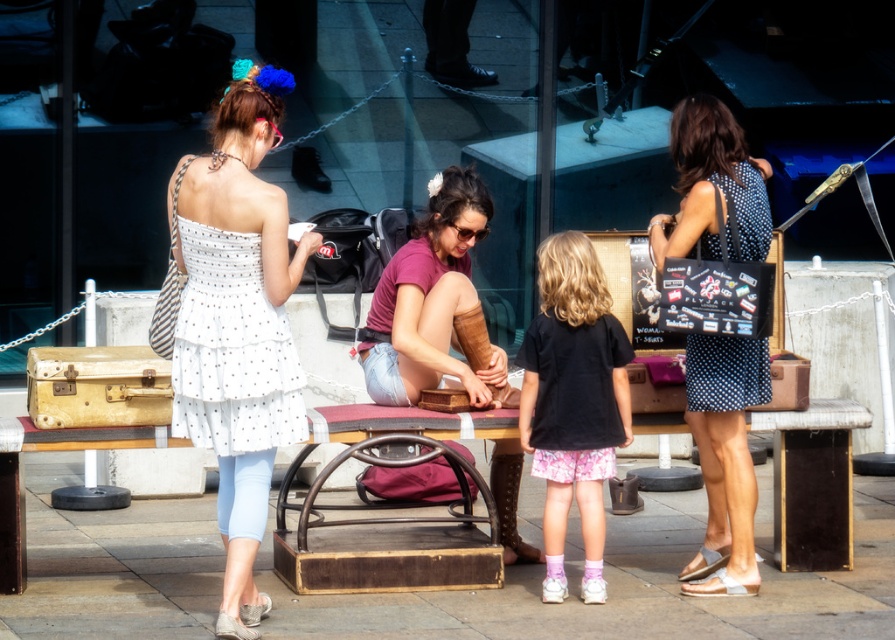
In the scene shown: Is white dotted fabric dress at left thinner than brown leather boots at center?

Correct, white dotted fabric dress at left's width is less than brown leather boots at center's.

Is white dotted fabric dress at left to the left of brown leather boots at center from the viewer's perspective?

Indeed, white dotted fabric dress at left is positioned on the left side of brown leather boots at center.

Image resolution: width=895 pixels, height=640 pixels. Find the location of `white dotted fabric dress at left`. white dotted fabric dress at left is located at coordinates (229, 342).

Does polka dot dress at right appear on the left side of black matte shirt at center?

Incorrect, polka dot dress at right is not on the left side of black matte shirt at center.

Image resolution: width=895 pixels, height=640 pixels. What are the coordinates of `polka dot dress at right` in the screenshot? It's located at (725, 448).

Does black matte shirt at center appear on the right side of black dotted fabric dress at right?

In fact, black matte shirt at center is to the left of black dotted fabric dress at right.

Can you confirm if black matte shirt at center is positioned to the left of black dotted fabric dress at right?

Correct, you'll find black matte shirt at center to the left of black dotted fabric dress at right.

Identify the location of black matte shirt at center. (573, 401).